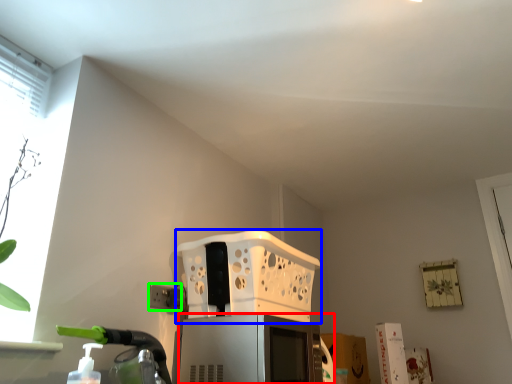
Question: Which object is positioned closest to appliance (highlighted by a red box)? Select from basket (highlighted by a blue box) and electric outlet (highlighted by a green box).

Choices:
 (A) basket
 (B) electric outlet

Answer: (B)